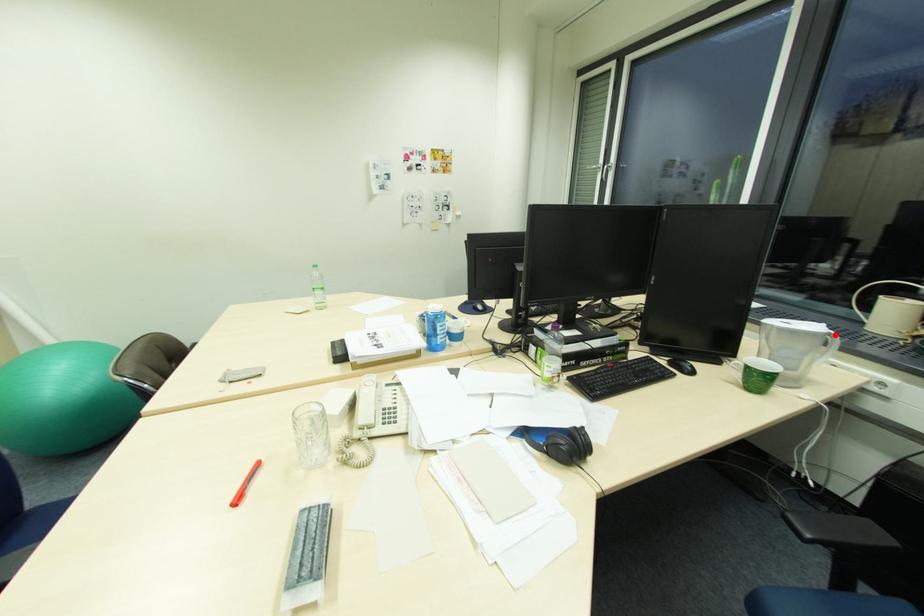
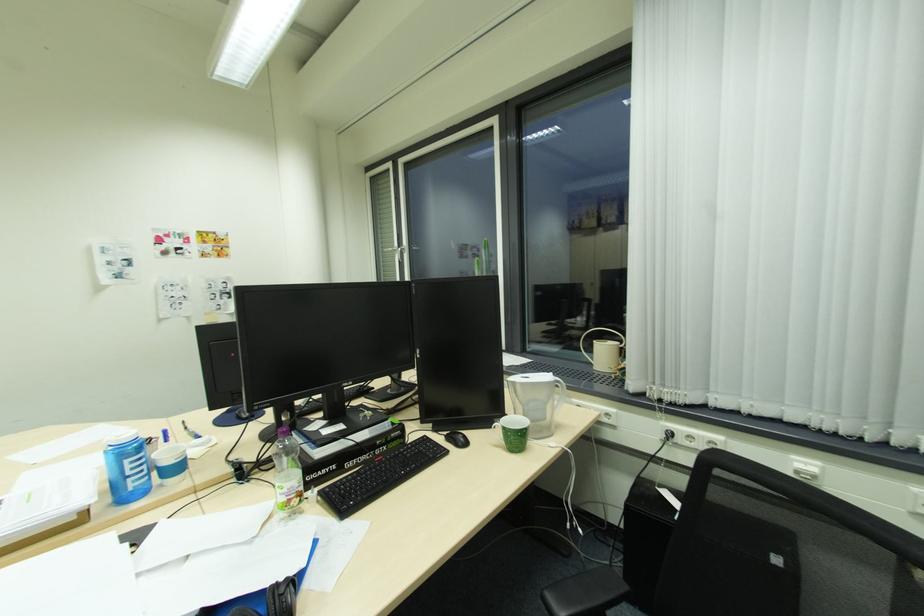
Question: I am providing you with two images of the same scene from different viewpoints. In image1, a red point is highlighted. Considering the same 3D point in image2, which of the following is correct?

Choices:
 (A) It is closer
 (B) It is farther

Answer: (B)